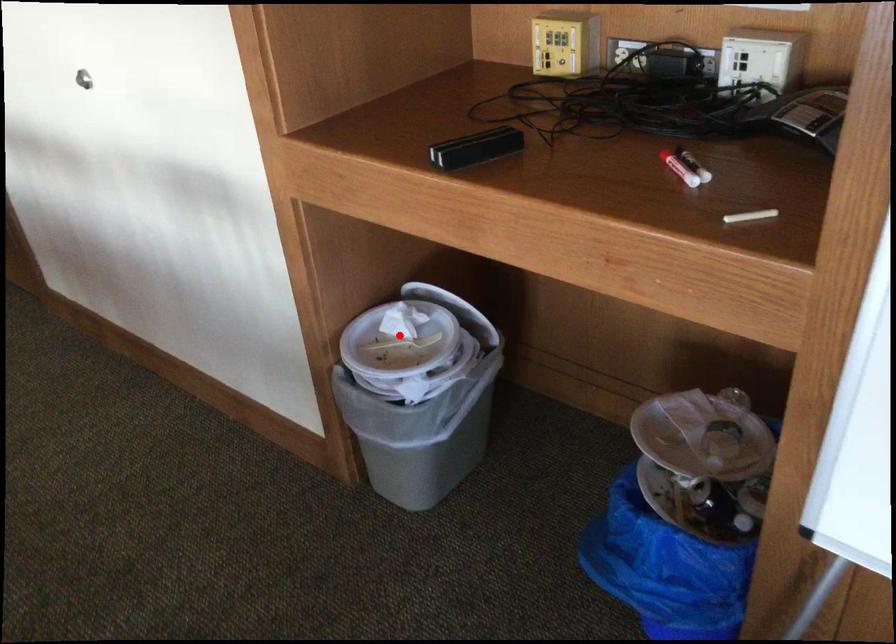
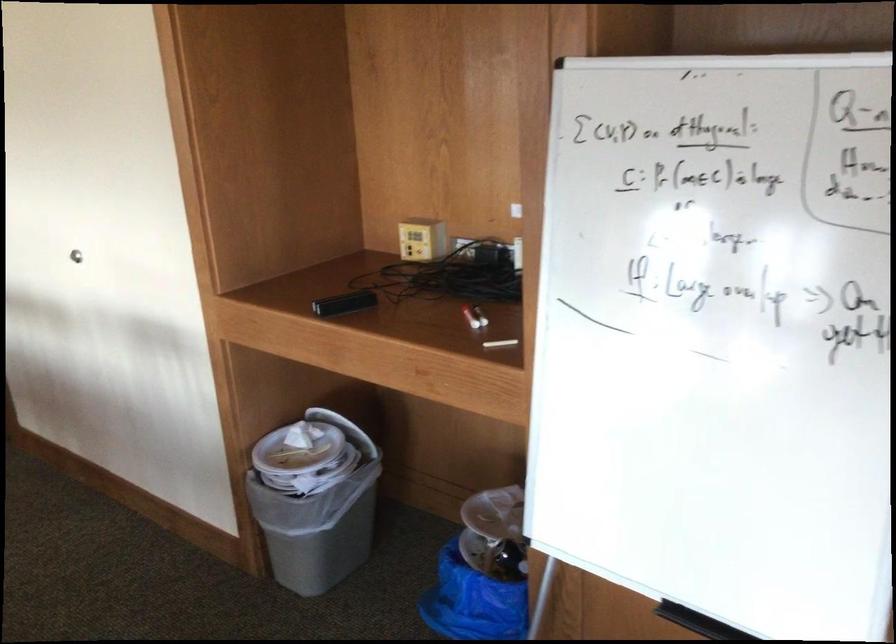
Where in the second image is the point corresponding to the highlighted location from the first image?

(297, 448)